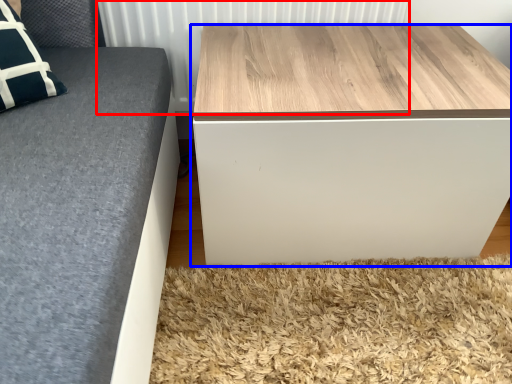
Question: Among these objects, which one is farthest to the camera, radiator (highlighted by a red box) or table (highlighted by a blue box)?

Choices:
 (A) radiator
 (B) table

Answer: (A)